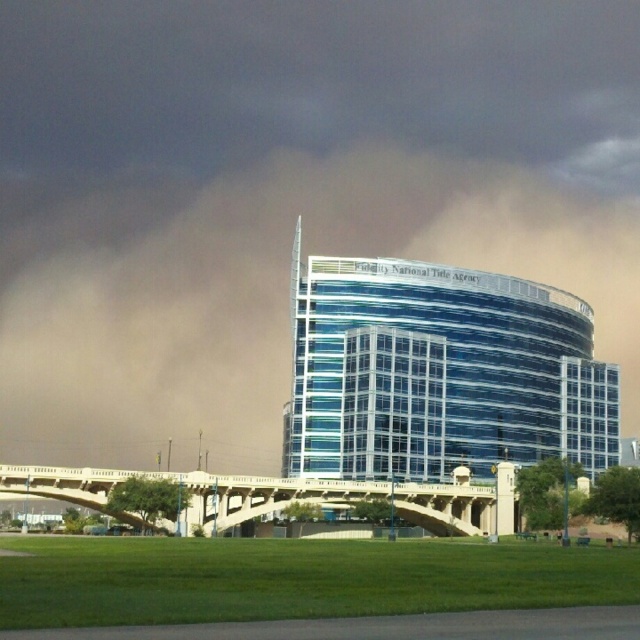
Is blue glass building at center positioned at the back of beige concrete bridge at center?

That is True.

Can you confirm if blue glass building at center is positioned to the left of beige concrete bridge at center?

No, blue glass building at center is not to the left of beige concrete bridge at center.

What do you see at coordinates (440, 371) in the screenshot?
I see `blue glass building at center` at bounding box center [440, 371].

At what (x,y) coordinates should I click in order to perform the action: click on blue glass building at center. Please return your answer as a coordinate pair (x, y). This screenshot has width=640, height=640. Looking at the image, I should click on (440, 371).

Is brown dusty cloud at upper center wider than blue glass building at center?

Indeed, brown dusty cloud at upper center has a greater width compared to blue glass building at center.

Who is more distant from viewer, (362, 4) or (419, 282)?

The point (362, 4) is more distant.

Find the location of a particular element. brown dusty cloud at upper center is located at coordinates (284, 195).

Between point (602, 285) and point (348, 496), which one is positioned behind?

Point (602, 285)

Is brown dusty cloud at upper center taller than beige concrete bridge at center?

Yes.

Is point (44, 4) farther from camera compared to point (259, 499)?

Yes, it is.

Where is `brown dusty cloud at upper center`? brown dusty cloud at upper center is located at coordinates (284, 195).